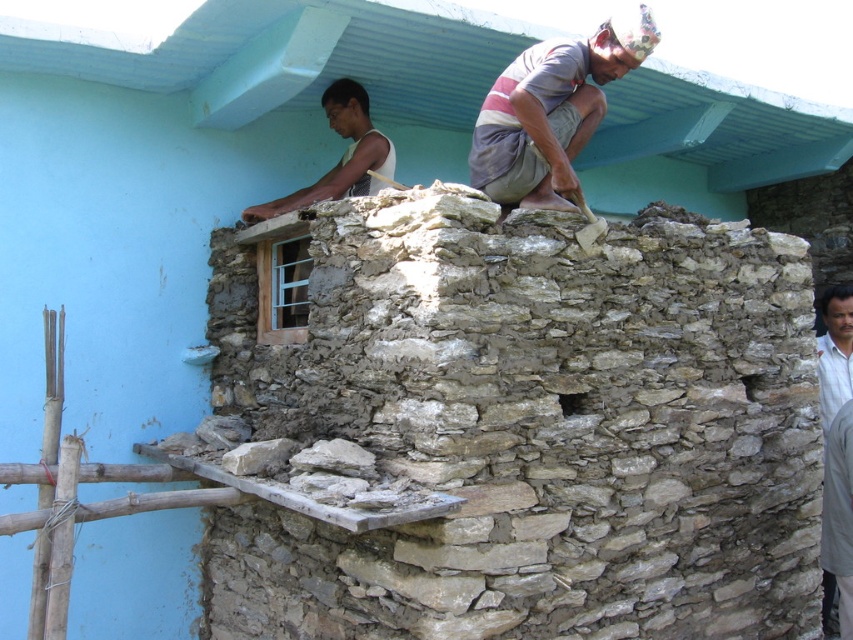
You are a construction supervisor checking the safety of workers on the wall. You notice the striped fabric headband at upper center and the white matte shirt at upper center. Which worker is positioned higher on the wall?

The striped fabric headband at upper center is located above the white matte shirt at upper center, so the worker with the striped fabric headband at upper center is positioned higher on the wall.

You are a construction worker who needs to hand a tool to both the striped fabric headband at upper center and the gray cotton shirt at upper right. Based on their positions, which worker should you approach first to ensure you can reach them without moving too far from your current spot?

The striped fabric headband at upper center is to the left of gray cotton shirt at upper right, so you should approach the striped fabric headband at upper center first since they are closer to your current position on the left side.